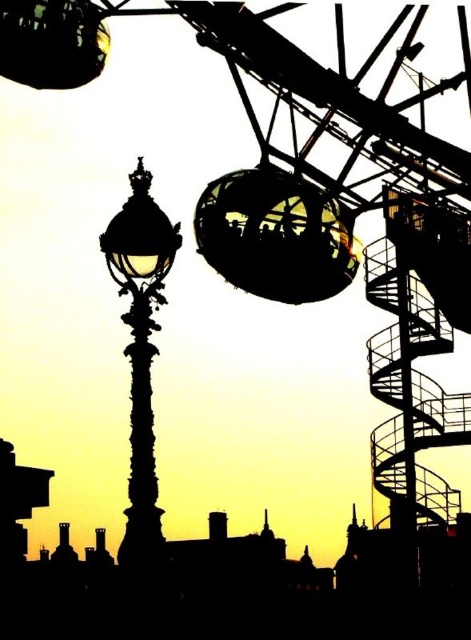
You are an architect evaluating the structural integrity of the spiral steel staircase at right and the metallic glass sphere at upper center. Which object has a narrower width?

The spiral steel staircase at right has a lesser width compared to the metallic glass sphere at upper center.

You are an architect designing a new pathway between the spiral steel staircase at right and the silhouette ornate street light at left. Considering their widths, which object should you place closer to the pathway to ensure it is wide enough for two people to walk side by side comfortably?

The spiral steel staircase at right has a larger width than the silhouette ornate street light at left. To ensure the pathway is wide enough for two people to walk side by side, you should place the spiral steel staircase at right closer to the pathway since its greater width allows for more space.